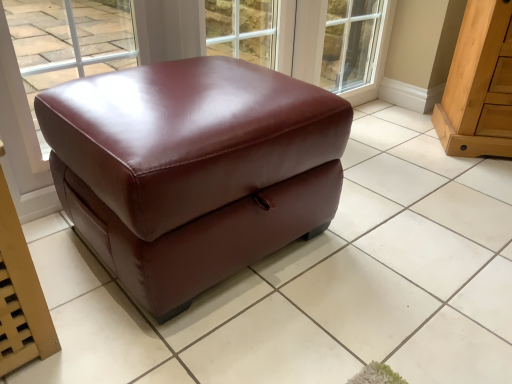
Find the location of a particular element. The image size is (512, 384). free region on the left part of light brown wood drawer at right, placed as the 1th furniture when sorted from right to left is located at coordinates (406, 144).